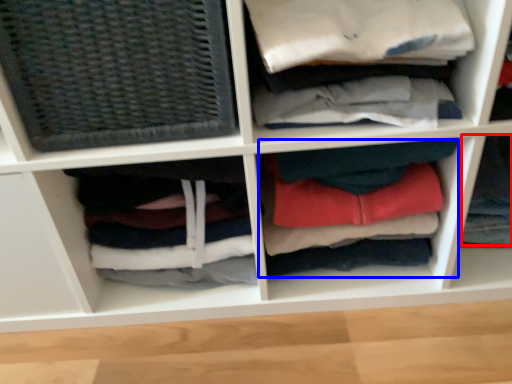
Question: Which object is further to the camera taking this photo, clothing (highlighted by a red box) or clothing (highlighted by a blue box)?

Choices:
 (A) clothing
 (B) clothing

Answer: (A)